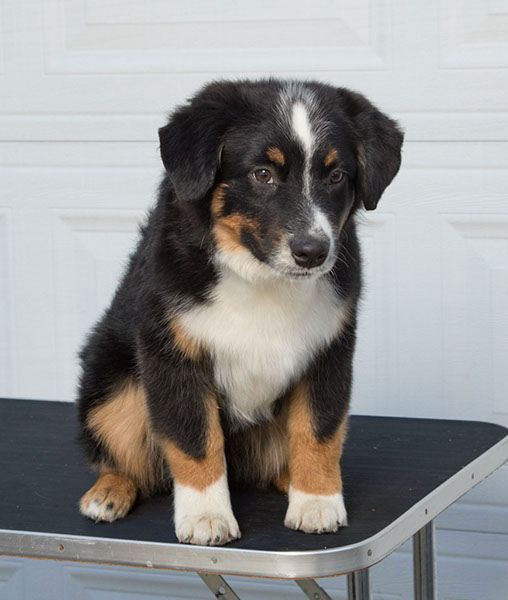
Identify the location of table. point(395,461).